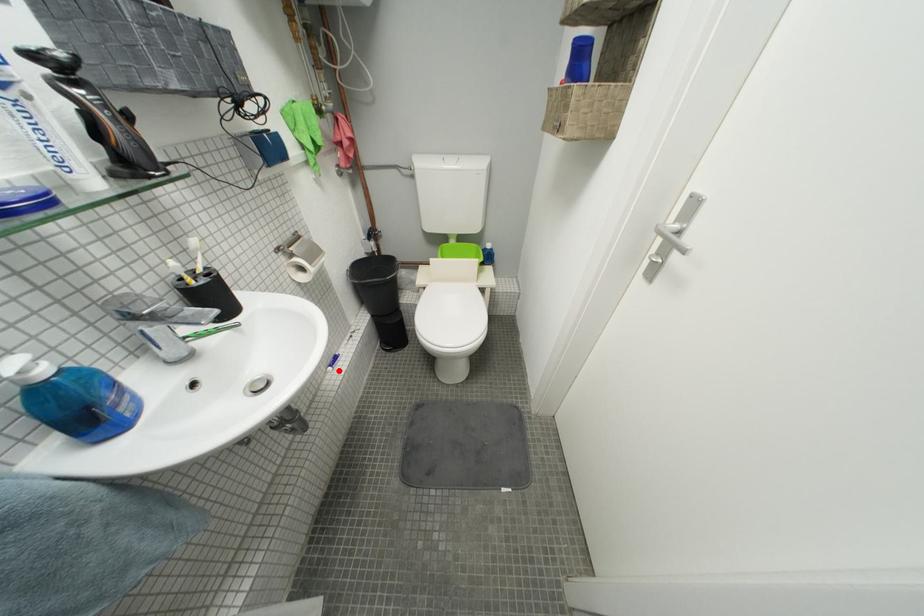
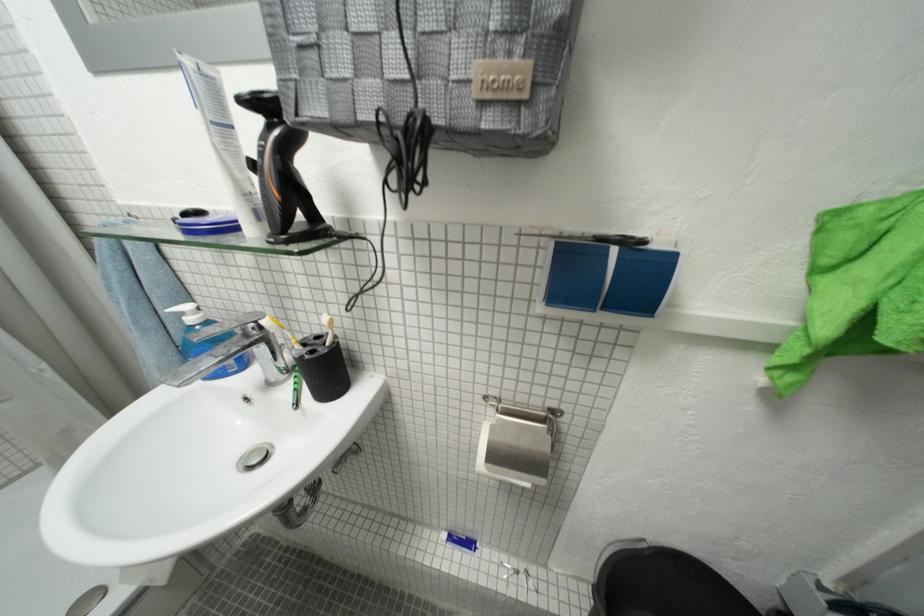
In the second image, find the point that corresponds to the highlighted location in the first image.

(454, 538)